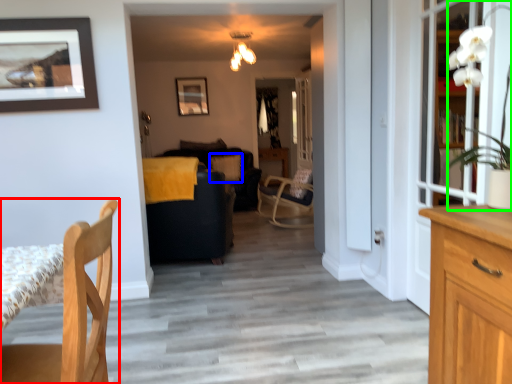
Question: Which is farther away from chair (highlighted by a red box)? pillow (highlighted by a blue box) or houseplant (highlighted by a green box)?

Choices:
 (A) pillow
 (B) houseplant

Answer: (A)